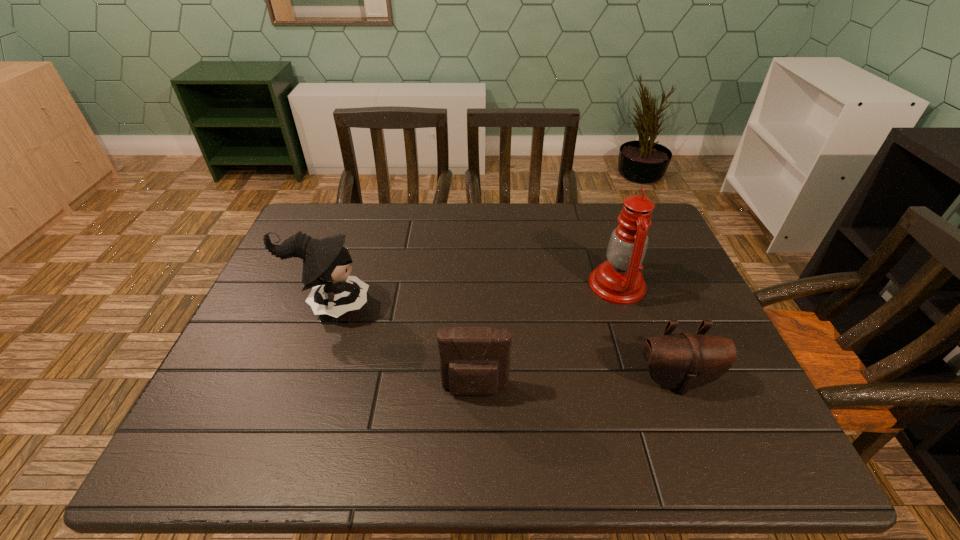
Find the location of `free point between the tallest object and the third object from right to left`. free point between the tallest object and the third object from right to left is located at coordinates (546, 338).

What are the coordinates of `free area in between the second object from left to right and the tallest object` in the screenshot? It's located at (546, 338).

Where is `unoccupied area between the left pouch and the tallest object`? unoccupied area between the left pouch and the tallest object is located at coordinates tap(546, 338).

Find the location of a particular element. The height and width of the screenshot is (540, 960). empty space between the left pouch and the tallest object is located at coordinates (546, 338).

The image size is (960, 540). In order to click on free space between the doll and the left pouch in this screenshot , I will do `click(402, 347)`.

Find the location of a particular element. free space between the oil lamp and the doll is located at coordinates (473, 295).

Find the location of a particular element. The width and height of the screenshot is (960, 540). free area in between the second object from left to right and the right pouch is located at coordinates (575, 385).

Where is `object identified as the third closest to the left pouch`? This screenshot has width=960, height=540. object identified as the third closest to the left pouch is located at coordinates (619, 280).

I want to click on object that stands as the closest to the second object from left to right, so click(326, 262).

This screenshot has height=540, width=960. Find the location of `vacant area in the image that satisfies the following two spatial constraints: 1. on the front side of the oil lamp; 2. at the face of the leftmost object`. vacant area in the image that satisfies the following two spatial constraints: 1. on the front side of the oil lamp; 2. at the face of the leftmost object is located at coordinates (624, 305).